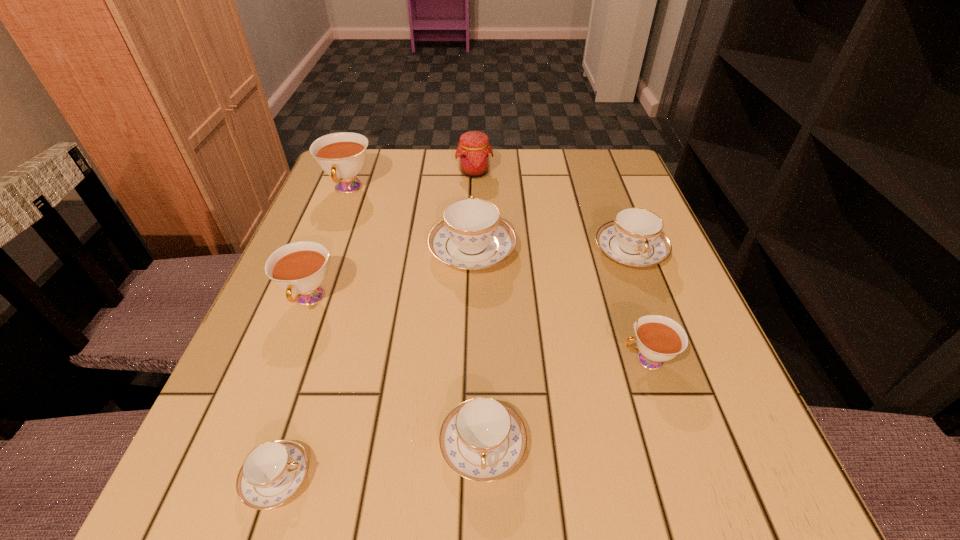
I want to click on the shortest object, so click(x=273, y=472).

At what (x,y) coordinates should I click in order to perform the action: click on free spot located on the side of the tallest teacup with the handle. Please return your answer as a coordinate pair (x, y). Looking at the image, I should click on (287, 344).

This screenshot has height=540, width=960. I want to click on vacant position located on the right of the red jam, so click(629, 173).

Locate an element on the screen. free space located on the side with the handle of the biggest blue teacup is located at coordinates (473, 194).

Find the location of a particular element. The width and height of the screenshot is (960, 540). vacant space located on the side with the handle of the biggest blue teacup is located at coordinates (474, 159).

Where is `free space located on the side with the handle of the biggest blue teacup`? free space located on the side with the handle of the biggest blue teacup is located at coordinates (473, 197).

At what (x,y) coordinates should I click in order to perform the action: click on vacant space situated on the side of the second biggest white teacup with the handle. Please return your answer as a coordinate pair (x, y). This screenshot has width=960, height=540. Looking at the image, I should click on (256, 438).

Where is `blank area located on the side with the handle of the third smallest blue teacup`? The height and width of the screenshot is (540, 960). blank area located on the side with the handle of the third smallest blue teacup is located at coordinates (660, 333).

You are a GUI agent. You are given a task and a screenshot of the screen. Output one action in this format:
    pyautogui.click(x=<x>, y=<y>)
    Task: Click on the vacant space located 0.350m on the side of the third nearest object with the handle
    The height and width of the screenshot is (540, 960).
    Given the screenshot: What is the action you would take?
    pyautogui.click(x=404, y=360)

Locate an element on the screen. The width and height of the screenshot is (960, 540). free space located on the side of the third nearest object with the handle is located at coordinates (582, 360).